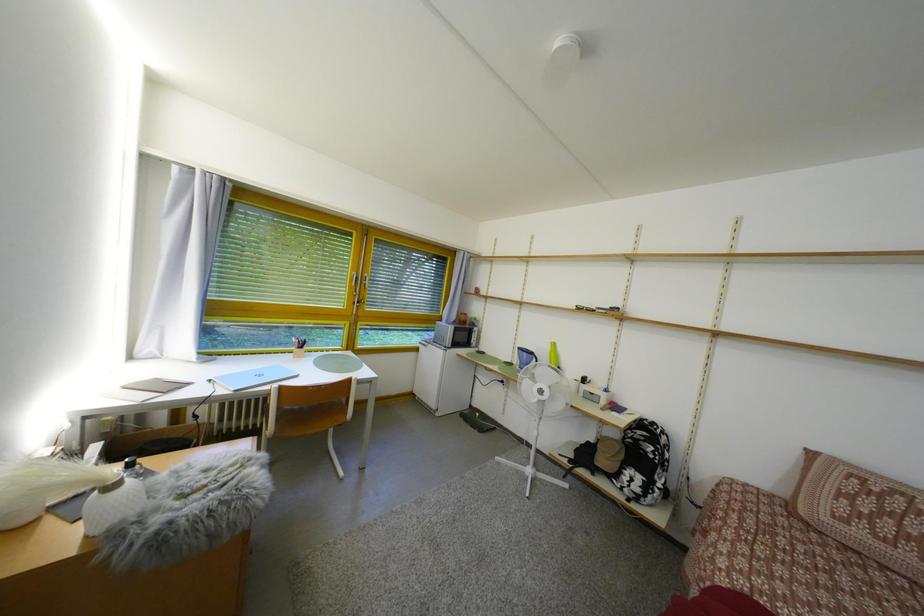
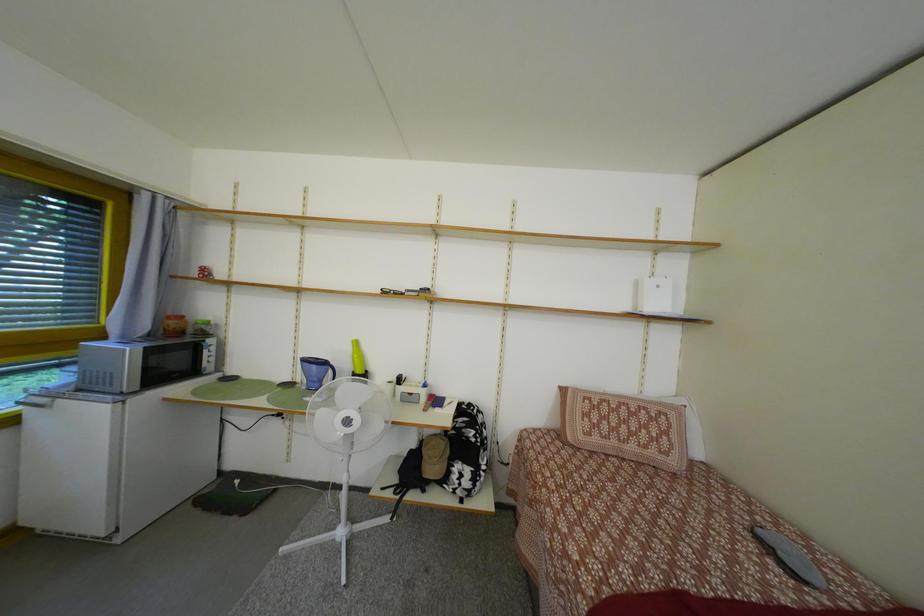
Question: The images are taken continuously from a first-person perspective. In which direction is your viewpoint rotating?

Choices:
 (A) Left
 (B) Right
 (C) Up
 (D) Down

Answer: (B)